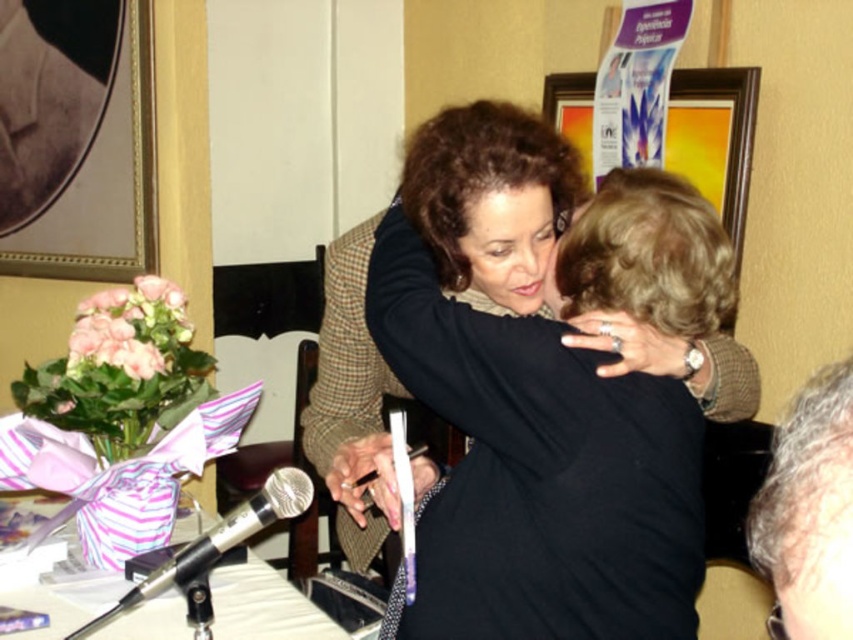
Can you confirm if black matte shirt at center is shorter than wooden picture frame at upper center?

No.

What do you see at coordinates (534, 461) in the screenshot? This screenshot has height=640, width=853. I see `black matte shirt at center` at bounding box center [534, 461].

Image resolution: width=853 pixels, height=640 pixels. What do you see at coordinates (534, 461) in the screenshot?
I see `black matte shirt at center` at bounding box center [534, 461].

The width and height of the screenshot is (853, 640). In order to click on black matte shirt at center in this screenshot , I will do `click(534, 461)`.

Which is in front, point (706, 112) or point (143, 598)?

Point (143, 598)

Locate an element on the screen. The image size is (853, 640). wooden picture frame at upper center is located at coordinates (714, 138).

Is gold/gilded picture frame at upper left positioned at the back of pink silk flowers at left?

Yes, it is behind pink silk flowers at left.

Is gold/gilded picture frame at upper left to the right of pink silk flowers at left from the viewer's perspective?

In fact, gold/gilded picture frame at upper left is to the left of pink silk flowers at left.

Which is in front, point (6, 170) or point (88, 307)?

Point (88, 307)

What are the coordinates of `gold/gilded picture frame at upper left` in the screenshot? It's located at (76, 140).